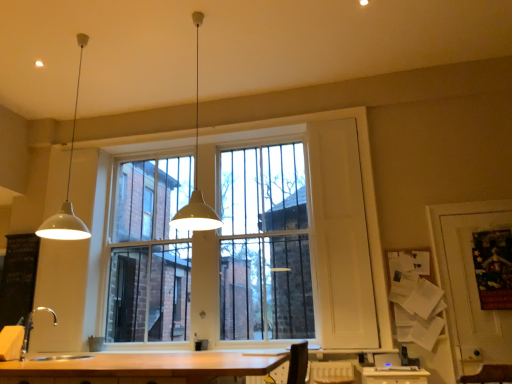
Locate an element on the screen. This screenshot has width=512, height=384. black chalkboard at left is located at coordinates (18, 277).

The image size is (512, 384). Describe the element at coordinates (18, 277) in the screenshot. I see `black chalkboard at left` at that location.

Where is `white matte pendant light at upper left, which is counted as the first lamp, starting from the left`? white matte pendant light at upper left, which is counted as the first lamp, starting from the left is located at coordinates (67, 187).

In order to click on silver metallic faucet at lower left in this screenshot , I will do `click(32, 328)`.

This screenshot has width=512, height=384. What do you see at coordinates (32, 328) in the screenshot?
I see `silver metallic faucet at lower left` at bounding box center [32, 328].

Locate an element on the screen. black chalkboard at left is located at coordinates pyautogui.click(x=18, y=277).

How much distance is there between white glass window at center and silver metallic faucet at lower left?

The distance of white glass window at center from silver metallic faucet at lower left is 9.57 feet.

From the image's perspective, relative to silver metallic faucet at lower left, is white glass window at center above or below?

From the image's perspective, white glass window at center appears above silver metallic faucet at lower left.

Does point (365, 322) appear closer or farther from the camera than point (38, 308)?

Point (365, 322) is positioned closer to the camera compared to point (38, 308).

Find the location of a particular element. faucet below the white glass window at center (from the image's perspective) is located at coordinates (32, 328).

Which of these two, silver metallic faucet at lower left or white glass window at center, is thinner?

white glass window at center is thinner.

From a real-world perspective, does silver metallic faucet at lower left sit lower than white glass window at center?

Yes, from a real-world perspective, silver metallic faucet at lower left is below white glass window at center.

Considering the relative sizes of silver metallic faucet at lower left and white glass window at center in the image provided, is silver metallic faucet at lower left taller than white glass window at center?

No.

Would you say silver metallic faucet at lower left is outside white glass window at center?

Yes, silver metallic faucet at lower left is outside of white glass window at center.

Between white glass window at center and white matte pendant light at upper left, placed as the 2th lamp when sorted from right to left, which one appears on the left side from the viewer's perspective?

Positioned to the left is white matte pendant light at upper left, placed as the 2th lamp when sorted from right to left.

Considering the positions of objects white glass window at center and white matte pendant light at upper left, placed as the 2th lamp when sorted from right to left, in the image provided, who is behind, white glass window at center or white matte pendant light at upper left, placed as the 2th lamp when sorted from right to left,?

white glass window at center is further away from the camera.

Which point is more forward, (x=334, y=185) or (x=62, y=220)?

The point (x=62, y=220) is closer to the camera.

Which of these two, white glass window at center or white matte pendant light at upper left, placed as the 2th lamp when sorted from right to left, is thinner?

Thinner between the two is white glass window at center.

Is white matte pendant light at upper left, placed as the 2th lamp when sorted from right to left, positioned with its back to black chalkboard at left?

No, white matte pendant light at upper left, placed as the 2th lamp when sorted from right to left, is not facing away from black chalkboard at left.

Is white matte pendant light at upper left, which is counted as the first lamp, starting from the left, closer to the viewer compared to black chalkboard at left?

Yes, it is in front of black chalkboard at left.

Choose the correct answer: Is white matte pendant light at upper left, placed as the 2th lamp when sorted from right to left, inside black chalkboard at left or outside it?

white matte pendant light at upper left, placed as the 2th lamp when sorted from right to left, is spatially situated outside black chalkboard at left.

From a real-world perspective, between white glass window at center and black chalkboard at left, who is vertically higher?

In real-world perspective, white glass window at center is above.

Considering the sizes of white glass window at center and black chalkboard at left in the image, is white glass window at center bigger or smaller than black chalkboard at left?

Clearly, white glass window at center is larger in size than black chalkboard at left.

Considering the positions of point (350, 282) and point (25, 307), is point (350, 282) closer or farther from the camera than point (25, 307)?

Clearly, point (350, 282) is closer to the camera than point (25, 307).

Based on the photo, in the image, is white glass window at center on the left side or the right side of black chalkboard at left?

white glass window at center is to the right of black chalkboard at left.

Which is more to the right, white glass window at center or white matte pendant light at center, the second lamp in the left-to-right sequence?

white matte pendant light at center, the second lamp in the left-to-right sequence, is more to the right.

Is white glass window at center located outside white matte pendant light at center, the second lamp in the left-to-right sequence?

Indeed, white glass window at center is completely outside white matte pendant light at center, the second lamp in the left-to-right sequence.

Is point (348, 286) positioned behind point (200, 203)?

No, (348, 286) is in front of (200, 203).

Can you confirm if white glass window at center is smaller than white matte pendant light at center, the second lamp in the left-to-right sequence?

Incorrect, white glass window at center is not smaller in size than white matte pendant light at center, the second lamp in the left-to-right sequence.

Is white matte pendant light at upper left, placed as the 2th lamp when sorted from right to left, smaller than silver metallic faucet at lower left?

No.

Considering the relative sizes of white matte pendant light at upper left, placed as the 2th lamp when sorted from right to left, and silver metallic faucet at lower left in the image provided, is white matte pendant light at upper left, placed as the 2th lamp when sorted from right to left, wider than silver metallic faucet at lower left?

Yes, white matte pendant light at upper left, placed as the 2th lamp when sorted from right to left, is wider than silver metallic faucet at lower left.

Are white matte pendant light at upper left, placed as the 2th lamp when sorted from right to left, and silver metallic faucet at lower left beside each other?

No, white matte pendant light at upper left, placed as the 2th lamp when sorted from right to left, is not making contact with silver metallic faucet at lower left.

The height and width of the screenshot is (384, 512). What are the coordinates of `window on the right of silver metallic faucet at lower left` in the screenshot? It's located at (328, 217).

This screenshot has width=512, height=384. I want to click on faucet that appears below the white glass window at center (from the image's perspective), so click(x=32, y=328).

Which object lies further to the anchor point white matte pendant light at center, marked as the first lamp in a right-to-left arrangement, black chalkboard at left or white matte pendant light at upper left, which is counted as the first lamp, starting from the left?

black chalkboard at left.

In the scene shown: Which object lies further to the anchor point white glass window at center, white matte pendant light at upper left, placed as the 2th lamp when sorted from right to left, or black chalkboard at left?

black chalkboard at left.

Looking at the image, which one is located further to silver metallic faucet at lower left, white matte pendant light at upper left, which is counted as the first lamp, starting from the left, or white glass window at center?

Based on the image, white glass window at center appears to be further to silver metallic faucet at lower left.

Which object lies nearer to the anchor point black chalkboard at left, silver metallic faucet at lower left or white matte pendant light at upper left, placed as the 2th lamp when sorted from right to left?

silver metallic faucet at lower left is positioned closer to the anchor black chalkboard at left.

Estimate the real-world distances between objects in this image. Which object is further from white matte pendant light at center, marked as the first lamp in a right-to-left arrangement, white glass window at center or silver metallic faucet at lower left?

silver metallic faucet at lower left.

Considering their positions, is black chalkboard at left positioned further to white matte pendant light at upper left, which is counted as the first lamp, starting from the left, than white glass window at center?

Based on the image, white glass window at center appears to be further to white matte pendant light at upper left, which is counted as the first lamp, starting from the left.

Estimate the real-world distances between objects in this image. Which object is further from white glass window at center, white matte pendant light at upper left, placed as the 2th lamp when sorted from right to left, or white matte pendant light at center, the second lamp in the left-to-right sequence?

white matte pendant light at upper left, placed as the 2th lamp when sorted from right to left, lies further to white glass window at center than the other object.

Which object lies further to the anchor point silver metallic faucet at lower left, white matte pendant light at upper left, which is counted as the first lamp, starting from the left, or black chalkboard at left?

white matte pendant light at upper left, which is counted as the first lamp, starting from the left, is positioned further to the anchor silver metallic faucet at lower left.

The image size is (512, 384). I want to click on lamp that lies between white matte pendant light at center, the second lamp in the left-to-right sequence, and silver metallic faucet at lower left from top to bottom, so click(x=67, y=187).

The height and width of the screenshot is (384, 512). I want to click on window located between black chalkboard at left and white matte pendant light at center, the second lamp in the left-to-right sequence, in the left-right direction, so click(328, 217).

The height and width of the screenshot is (384, 512). Find the location of `lamp between black chalkboard at left and white matte pendant light at center, the second lamp in the left-to-right sequence`. lamp between black chalkboard at left and white matte pendant light at center, the second lamp in the left-to-right sequence is located at coordinates (67, 187).

You are a GUI agent. You are given a task and a screenshot of the screen. Output one action in this format:
    pyautogui.click(x=<x>, y=<y>)
    Task: Click on the faucet between black chalkboard at left and white matte pendant light at center, the second lamp in the left-to-right sequence, from left to right
    
    Given the screenshot: What is the action you would take?
    pyautogui.click(x=32, y=328)